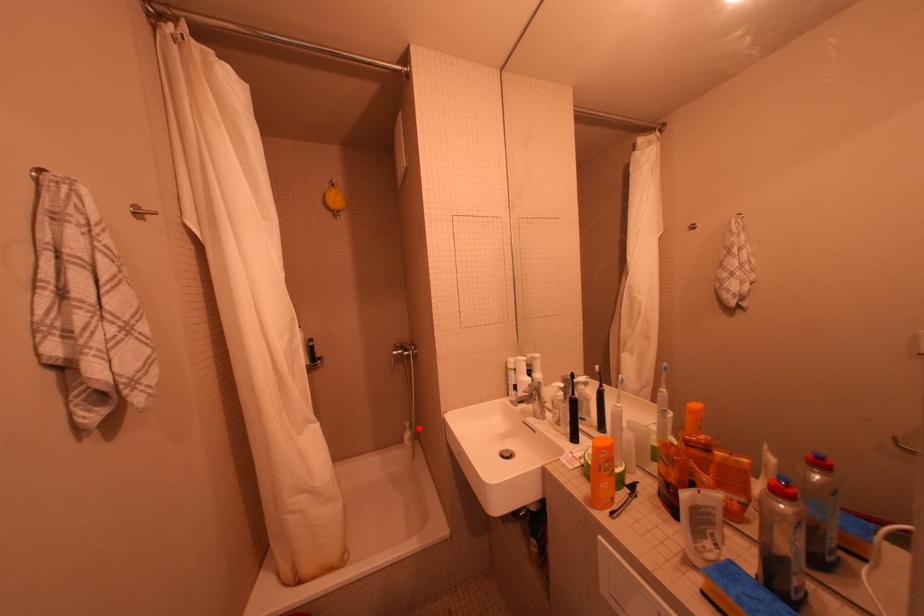
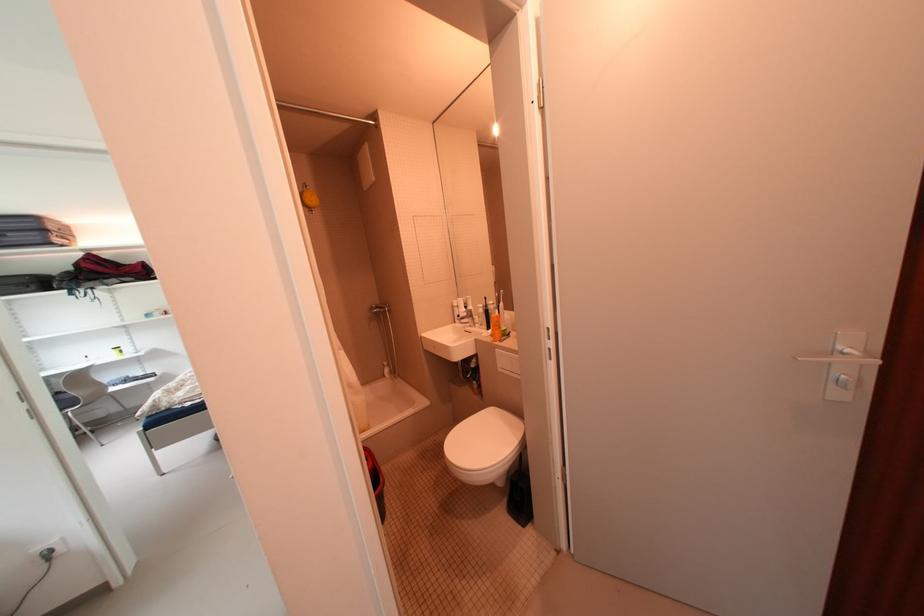
Where in the second image is the point corresponding to the highlighted location from the first image?

(396, 365)